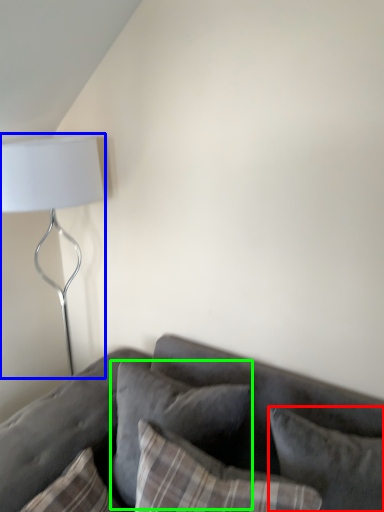
Question: Which object is positioned farthest from pillow (highlighted by a red box)? Select from lamp (highlighted by a blue box) and pillow (highlighted by a green box).

Choices:
 (A) lamp
 (B) pillow

Answer: (A)